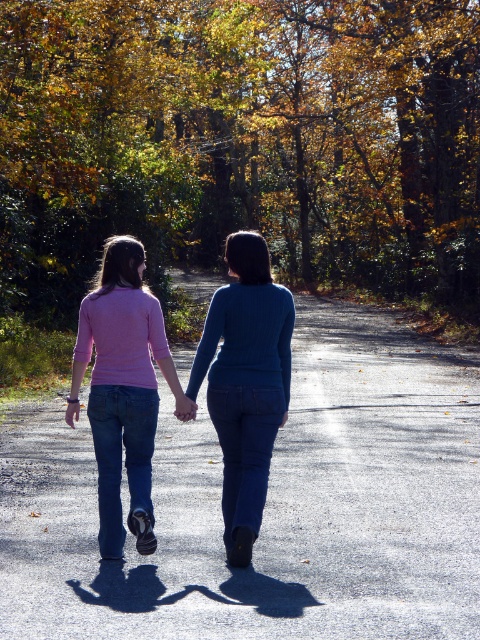
You are a photographer trying to capture the autumn leaves at center and the asphalt road at center in your shot. Based on their positions, which one will appear closer to the camera?

The autumn leaves at center has a greater height compared to asphalt road at center, so it will appear closer to the camera.

In the scene shown: You are a photographer trying to capture the two people walking on the path. Based on the scene, which object, the autumn leaves at center or the pink matte sweater at center, is positioned higher relative to the camera lens?

The autumn leaves at center is located above the pink matte sweater at center, so the autumn leaves at center is positioned higher relative to the camera lens.